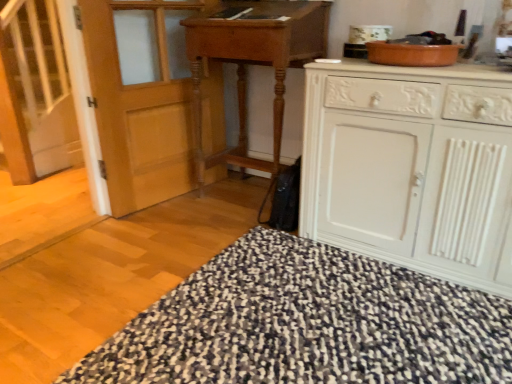
You are a GUI agent. You are given a task and a screenshot of the screen. Output one action in this format:
    pyautogui.click(x=<x>, y=<y>)
    Task: Click on the free space in front of white painted wood cabinet at right
    This screenshot has width=512, height=384.
    Given the screenshot: What is the action you would take?
    pyautogui.click(x=398, y=331)